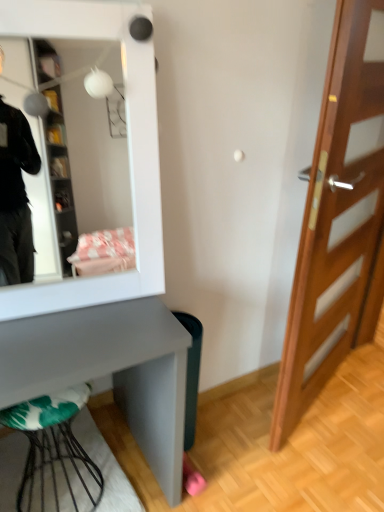
Question: In the image, is white glossy mirror at upper left on the left side or the right side of wooden door at right?

Choices:
 (A) left
 (B) right

Answer: (A)

Question: From a real-world perspective, is white glossy mirror at upper left above or below wooden door at right?

Choices:
 (A) above
 (B) below

Answer: (A)

Question: Estimate the real-world distances between objects in this image. Which object is closer to the green plastic trash bin at lower right?

Choices:
 (A) metallic wire stool at lower left
 (B) wooden door at right
 (C) white glossy mirror at upper left

Answer: (A)

Question: Which is farther from the metallic wire stool at lower left?

Choices:
 (A) wooden door at right
 (B) green plastic trash bin at lower right
 (C) white glossy mirror at upper left

Answer: (A)